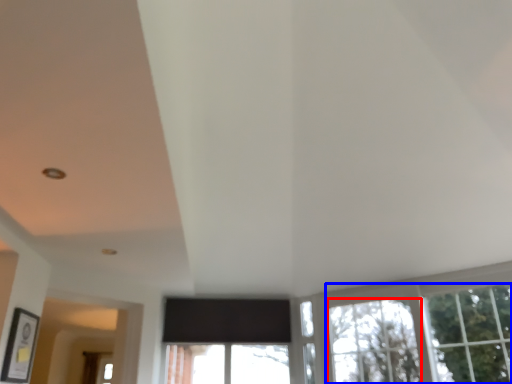
Question: Among these objects, which one is nearest to the camera, window (highlighted by a red box) or tree (highlighted by a blue box)?

Choices:
 (A) window
 (B) tree

Answer: (B)